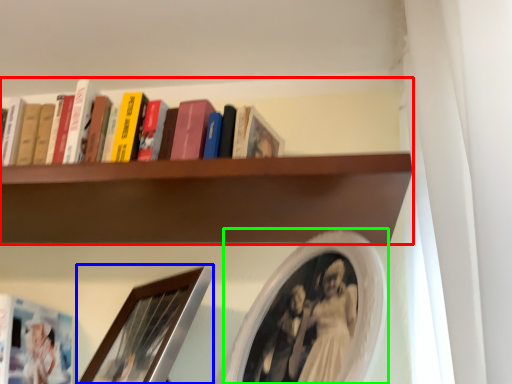
Question: Estimate the real-world distances between objects in this image. Which object is closer to shelf (highlighted by a red box), picture frame (highlighted by a blue box) or picture frame (highlighted by a green box)?

Choices:
 (A) picture frame
 (B) picture frame

Answer: (B)